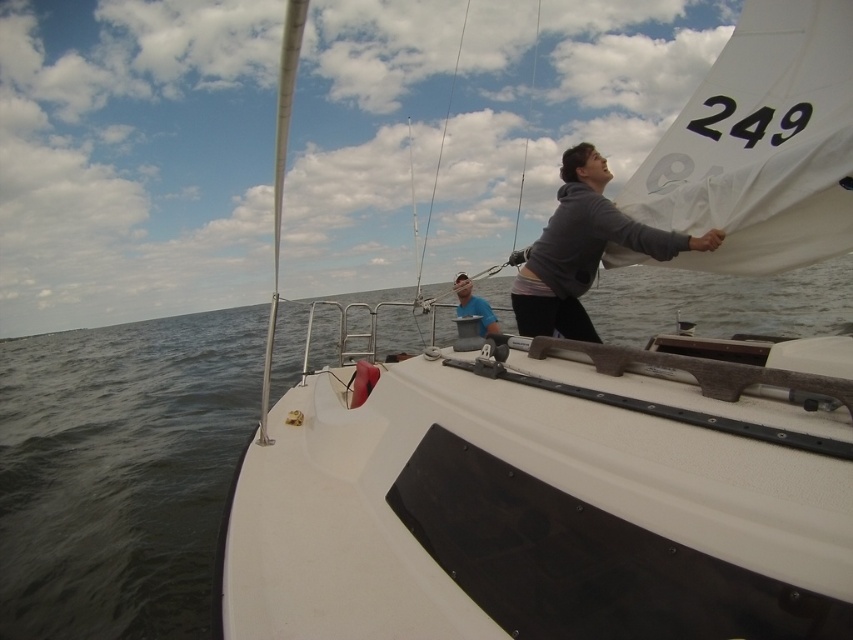
Question: Can you confirm if white matte sailboat at center is wider than blue fabric bucket at center?

Choices:
 (A) no
 (B) yes

Answer: (B)

Question: In this image, where is gray matte hoodie at center located relative to blue fabric bucket at center?

Choices:
 (A) left
 (B) right

Answer: (B)

Question: Which of the following is the farthest from the observer?

Choices:
 (A) (560, 244)
 (B) (480, 316)
 (C) (558, 604)

Answer: (B)

Question: Estimate the real-world distances between objects in this image. Which object is closer to the white matte sailboat at center?

Choices:
 (A) gray matte hoodie at center
 (B) blue fabric bucket at center

Answer: (A)

Question: Which point is farther from the camera taking this photo?

Choices:
 (A) (587, 396)
 (B) (468, 304)

Answer: (B)

Question: Is gray matte hoodie at center below blue fabric bucket at center?

Choices:
 (A) yes
 (B) no

Answer: (B)